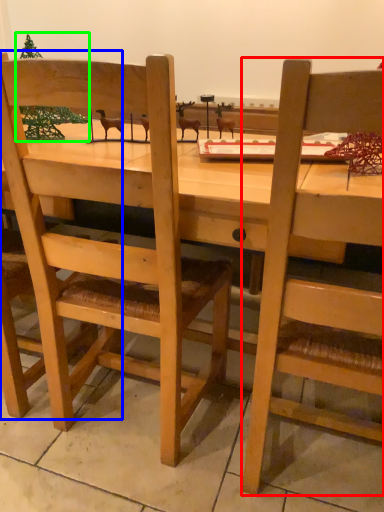
Question: Which object is the closest to the chair (highlighted by a red box)? Choose among these: chair (highlighted by a blue box) or christmas tree (highlighted by a green box).

Choices:
 (A) chair
 (B) christmas tree

Answer: (A)